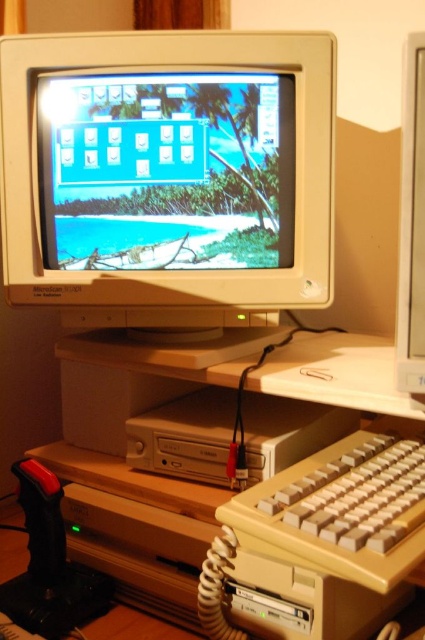
You are sitting at the vintage computer desk and want to reach both the beige plastic keyboard at lower center and the matte plastic monitor at right. Which object will your hand touch first if you extend it forward?

The beige plastic keyboard at lower center is closer to the viewer than the matte plastic monitor at right, so your hand will touch the beige plastic keyboard at lower center first.

You are trying to determine the best path to move a small tool from point A to point B on the vintage computer setup. Point A is at coordinates point (x=258, y=515) and point B is at coordinates point (x=413, y=307). Since you want to avoid obstacles, which point is closer to you to start the movement?

Point (x=258, y=515) is closer to the viewer than point (x=413, y=307), so you should start moving the tool from point (x=258, y=515) first as it is nearer to your position.

You are setting up a new monitor in the vintage computer setup. The CRT monitor is currently at point (237, 504). Where is the wooden shelf located?

The wooden shelf is located at the point (237, 504).